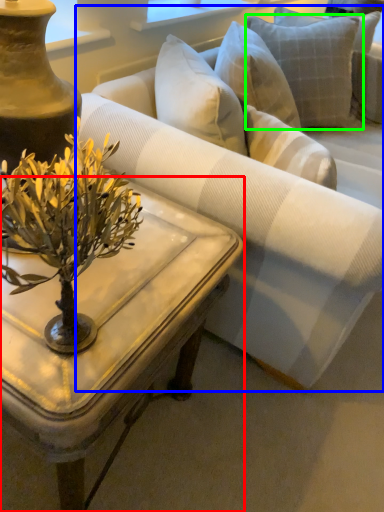
Question: Which object is positioned farthest from coffee table (highlighted by a red box)? Select from studio couch (highlighted by a blue box) and pillow (highlighted by a green box).

Choices:
 (A) studio couch
 (B) pillow

Answer: (B)